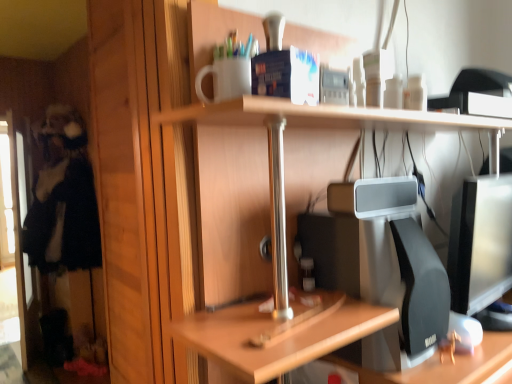
Where is `transparent glass screen door at left`? The height and width of the screenshot is (384, 512). transparent glass screen door at left is located at coordinates (19, 229).

What is the approximate width of transparent glass screen door at left?

transparent glass screen door at left is 4.91 inches wide.

Image resolution: width=512 pixels, height=384 pixels. What do you see at coordinates (19, 229) in the screenshot?
I see `transparent glass screen door at left` at bounding box center [19, 229].

The image size is (512, 384). Describe the element at coordinates (63, 199) in the screenshot. I see `black plush toy at left` at that location.

Where is `black plush toy at left`? black plush toy at left is located at coordinates (63, 199).

Where is `transparent glass screen door at left`? The image size is (512, 384). transparent glass screen door at left is located at coordinates (19, 229).

Which is more to the right, black plush toy at left or transparent glass screen door at left?

From the viewer's perspective, black plush toy at left appears more on the right side.

Considering their positions, is black plush toy at left located in front of or behind transparent glass screen door at left?

Clearly, black plush toy at left is in front of transparent glass screen door at left.

Which is closer, (56,215) or (29,282)?

Point (56,215).

From the picture: From the image's perspective, is black plush toy at left above or below transparent glass screen door at left?

Based on their image positions, black plush toy at left is located above transparent glass screen door at left.

From the picture: From a real-world perspective, which is physically below, black plush toy at left or transparent glass screen door at left?

From a 3D spatial view, transparent glass screen door at left is below.

Which of these two, black plush toy at left or transparent glass screen door at left, is wider?

Wider between the two is black plush toy at left.

Which of these two, black plush toy at left or transparent glass screen door at left, stands shorter?

black plush toy at left is shorter.

Considering the sizes of black plush toy at left and transparent glass screen door at left in the image, is black plush toy at left bigger or smaller than transparent glass screen door at left?

Clearly, black plush toy at left is larger in size than transparent glass screen door at left.

Would you say black plush toy at left contains transparent glass screen door at left?

Yes, transparent glass screen door at left can be found within black plush toy at left.

Are black plush toy at left and transparent glass screen door at left far apart?

No.

Is black plush toy at left aimed at transparent glass screen door at left?

Yes, black plush toy at left is aimed at transparent glass screen door at left.

How different are the orientations of black plush toy at left and transparent glass screen door at left in degrees?

There is a 14.5-degree angle between the facing directions of black plush toy at left and transparent glass screen door at left.

Identify the location of person above the transparent glass screen door at left (from the image's perspective). (63, 199).

Does transparent glass screen door at left appear on the left side of black plush toy at left?

Correct, you'll find transparent glass screen door at left to the left of black plush toy at left.

Is the depth of transparent glass screen door at left greater than that of black plush toy at left?

Yes, it is behind black plush toy at left.

Is point (9, 122) closer or farther from the camera than point (33, 227)?

Point (9, 122) is farther from the camera than point (33, 227).

From the image's perspective, is transparent glass screen door at left above black plush toy at left?

No, from the image's perspective, transparent glass screen door at left is not above black plush toy at left.

From a real-world perspective, who is located lower, transparent glass screen door at left or black plush toy at left?

transparent glass screen door at left is physically lower.

Between transparent glass screen door at left and black plush toy at left, which one has smaller width?

With smaller width is transparent glass screen door at left.

Who is taller, transparent glass screen door at left or black plush toy at left?

transparent glass screen door at left is taller.

Based on the photo, based on their sizes in the image, would you say transparent glass screen door at left is bigger or smaller than black plush toy at left?

Considering their sizes, transparent glass screen door at left takes up less space than black plush toy at left.

Is transparent glass screen door at left not within black plush toy at left?

That's incorrect, transparent glass screen door at left is not completely outside black plush toy at left.

Is transparent glass screen door at left touching black plush toy at left?

transparent glass screen door at left is not next to black plush toy at left, and they're not touching.

Is transparent glass screen door at left aimed at black plush toy at left?

Yes.

How many degrees apart are the facing directions of transparent glass screen door at left and black plush toy at left?

14.5 degrees.

Find the location of `person in front of the transparent glass screen door at left`. person in front of the transparent glass screen door at left is located at coordinates (63, 199).

This screenshot has width=512, height=384. Find the location of `person on the right of transparent glass screen door at left`. person on the right of transparent glass screen door at left is located at coordinates (63, 199).

Find the location of a particular element. Image resolution: width=512 pixels, height=384 pixels. screen door below the black plush toy at left (from the image's perspective) is located at coordinates (19, 229).